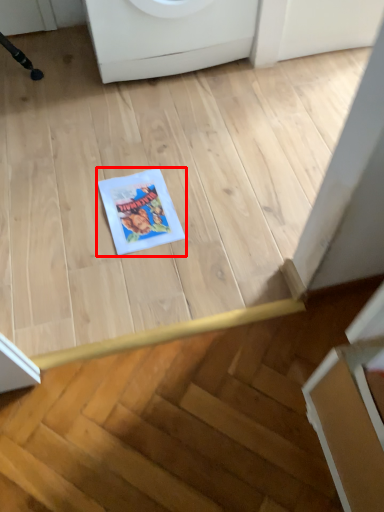
Question: Considering the relative positions of comic book (annotated by the red box) and washing machine in the image provided, where is comic book (annotated by the red box) located with respect to the staircase?

Choices:
 (A) right
 (B) left

Answer: (B)